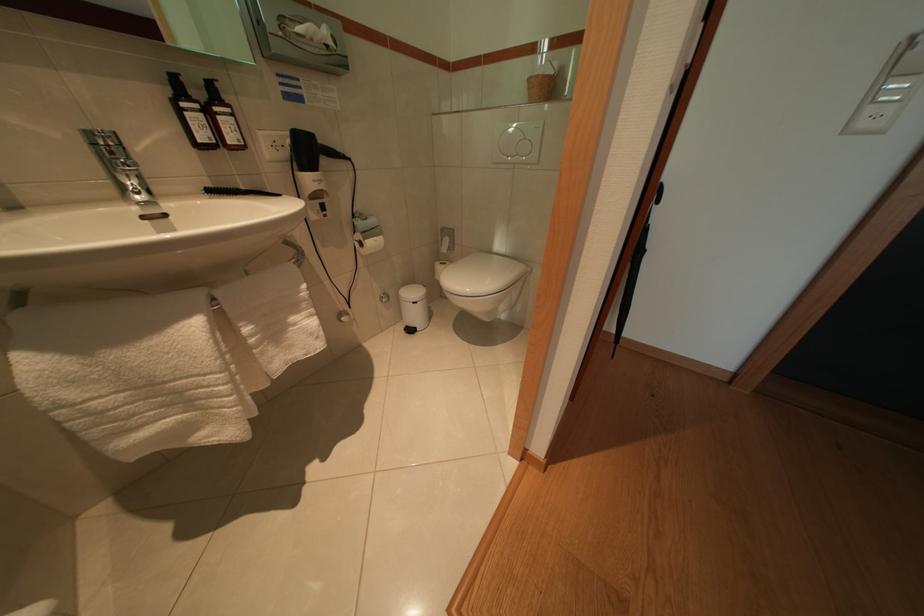
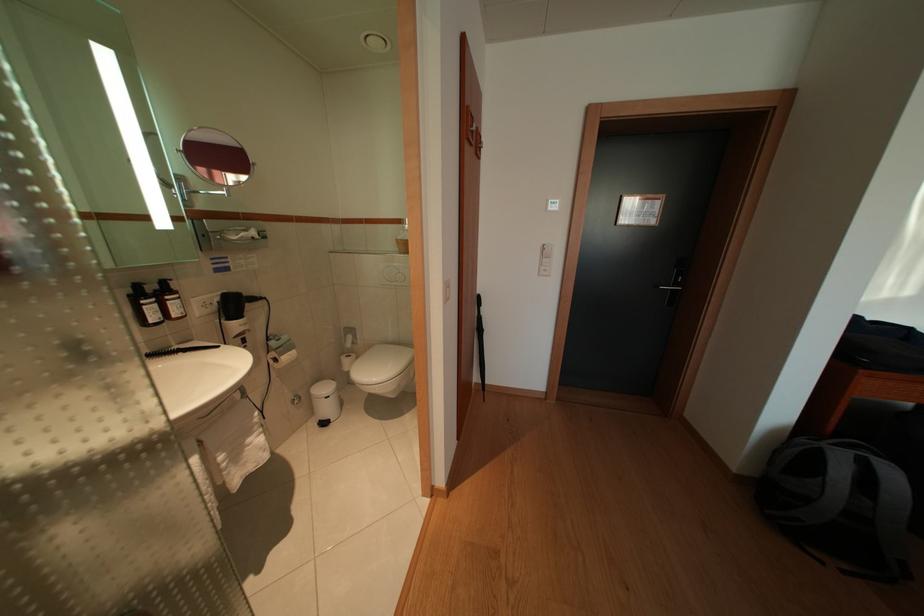
The point at (x=315, y=156) is marked in the first image. Where is the corresponding point in the second image?

(242, 310)